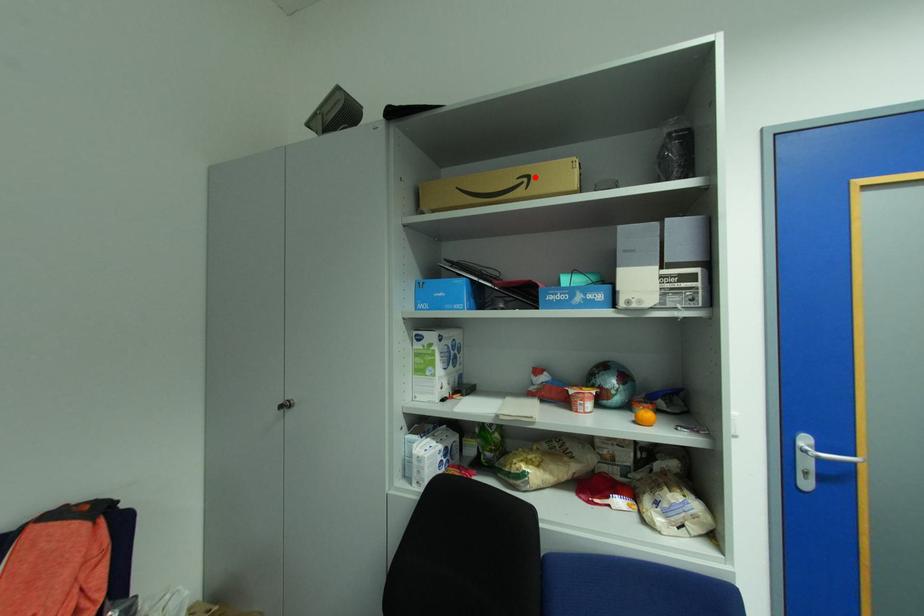
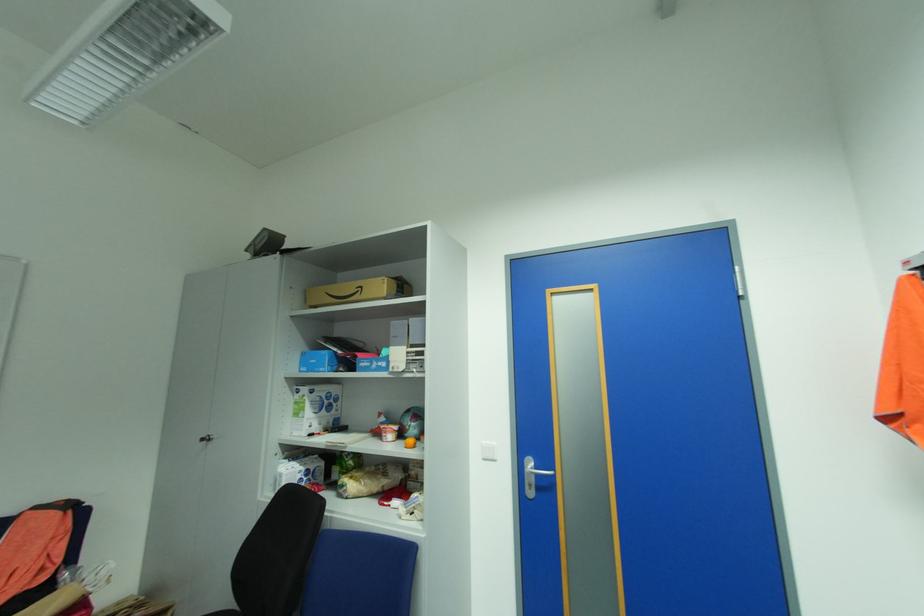
Find the pixel in the second image that matches the highlighted location in the first image.

(368, 286)